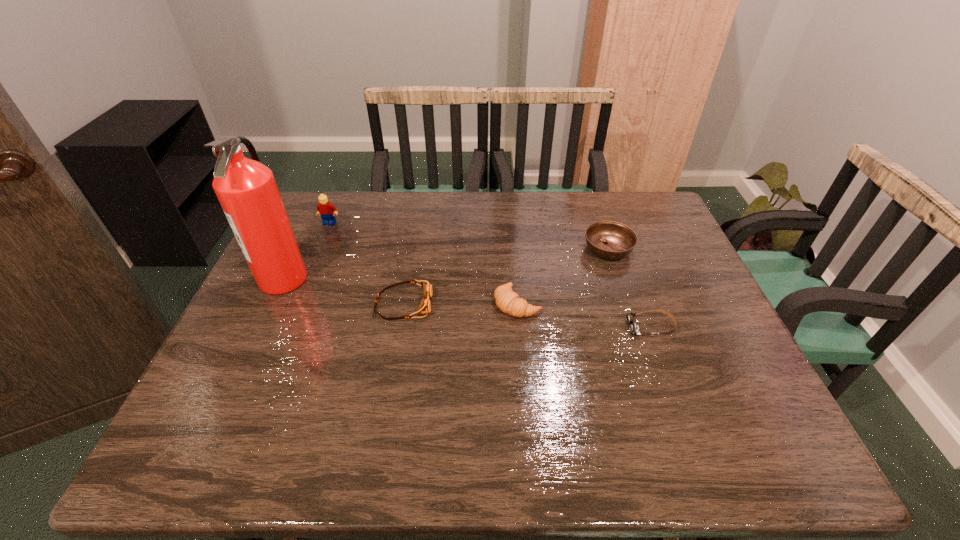
Identify the location of free location that satisfies the following two spatial constraints: 1. on the front-facing side of the soup bowl; 2. on the right side of the fifth shortest object. (319, 249).

You are a GUI agent. You are given a task and a screenshot of the screen. Output one action in this format:
    pyautogui.click(x=<x>, y=<y>)
    Task: Click on the vacant region that satisfies the following two spatial constraints: 1. at the nozzle of the fire extinguisher; 2. on the back side of the fourth object from left to right
    The image size is (960, 540).
    Given the screenshot: What is the action you would take?
    pyautogui.click(x=272, y=303)